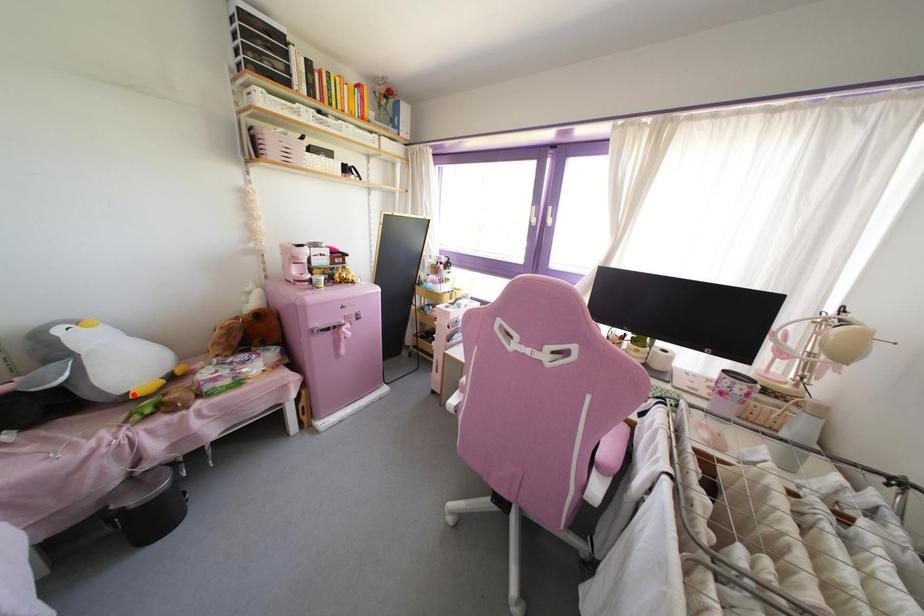
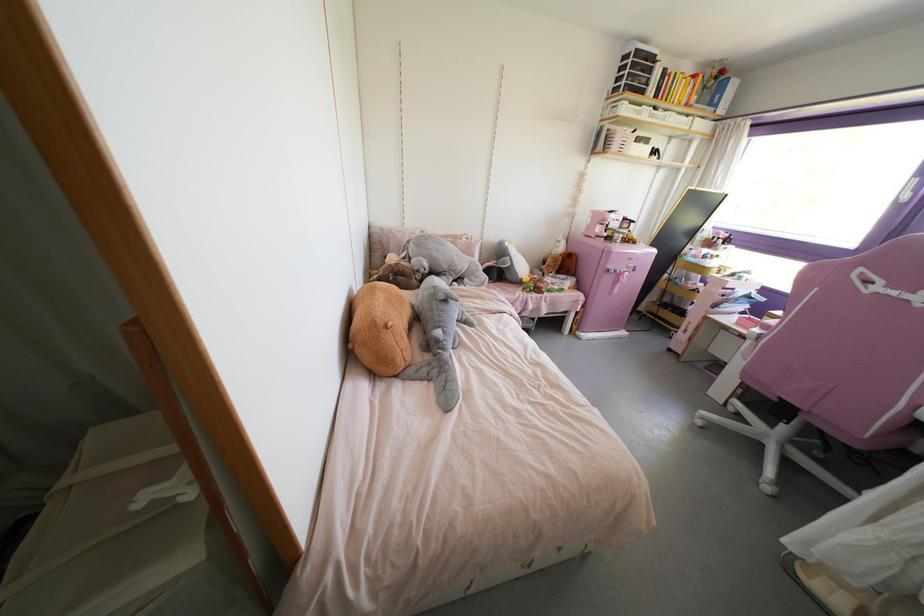
Locate, in the second image, the point that corresponds to the highlighted location in the first image.

(523, 280)